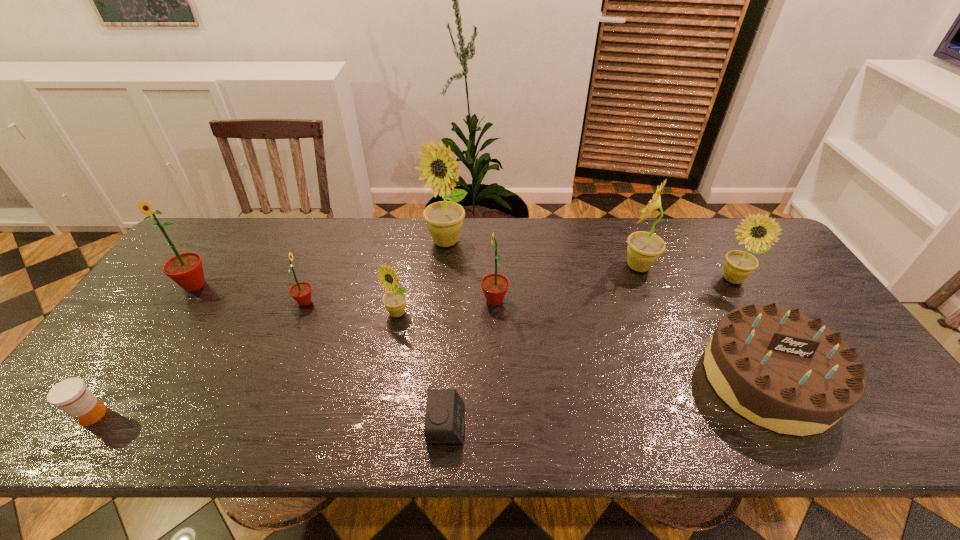
Locate an element on the screen. This screenshot has width=960, height=540. the tallest object is located at coordinates (444, 219).

The image size is (960, 540). Find the location of `the tallest sunflower`. the tallest sunflower is located at coordinates (444, 219).

Identify the location of the third yellow sunflower from left to right. (644, 248).

Where is `the sixth sunflower from left to right`? the sixth sunflower from left to right is located at coordinates (644, 248).

You are a GUI agent. You are given a task and a screenshot of the screen. Output one action in this format:
    pyautogui.click(x=<x>, y=<y>)
    Task: Click on the biggest green sunflower
    The height and width of the screenshot is (540, 960).
    Given the screenshot: What is the action you would take?
    pyautogui.click(x=186, y=269)

At what (x,y) coordinates should I click in order to perform the action: click on the leftmost green sunflower. Please return your answer as a coordinate pair (x, y). The image size is (960, 540). Looking at the image, I should click on (186, 269).

At what (x,y) coordinates should I click in order to perform the action: click on the third sunflower from right to left. Please return your answer as a coordinate pair (x, y). The width and height of the screenshot is (960, 540). Looking at the image, I should click on (494, 286).

The width and height of the screenshot is (960, 540). In order to click on the seventh object from left to right in this screenshot , I will do `click(494, 286)`.

Locate an element on the screen. The width and height of the screenshot is (960, 540). the rightmost sunflower is located at coordinates (738, 265).

Locate an element on the screen. The height and width of the screenshot is (540, 960). the third biggest yellow sunflower is located at coordinates (738, 265).